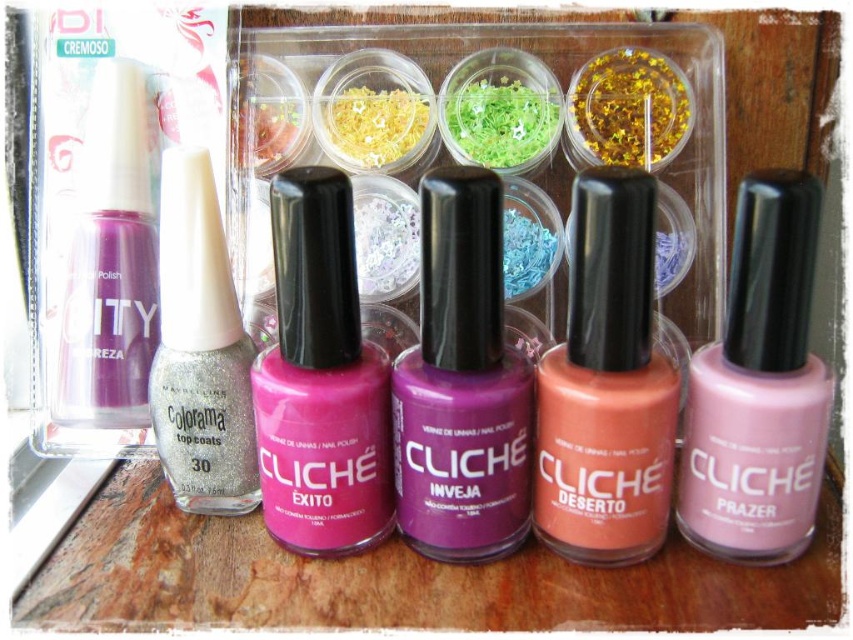
Question: Which point is farther from the camera taking this photo?

Choices:
 (A) (184, 340)
 (B) (381, 396)
 (C) (772, 253)
 (D) (140, 392)

Answer: (D)

Question: Which of the following is the closest to the observer?

Choices:
 (A) (643, 406)
 (B) (285, 324)
 (C) (474, 304)

Answer: (C)

Question: Is pink matte nail polish at center positioned in front of glittery silver nail polish at center?

Choices:
 (A) yes
 (B) no

Answer: (A)

Question: Does purple matte nail polish at center have a greater width compared to glittery silver nail polish at center?

Choices:
 (A) no
 (B) yes

Answer: (B)

Question: Does matte coral nail polish at center have a smaller size compared to glittery silver nail polish at center?

Choices:
 (A) yes
 (B) no

Answer: (A)

Question: Which is nearer to the matte purple nail polish at left?

Choices:
 (A) matte coral nail polish at center
 (B) purple matte nail polish at center
 (C) matte pink nail polish at center

Answer: (C)